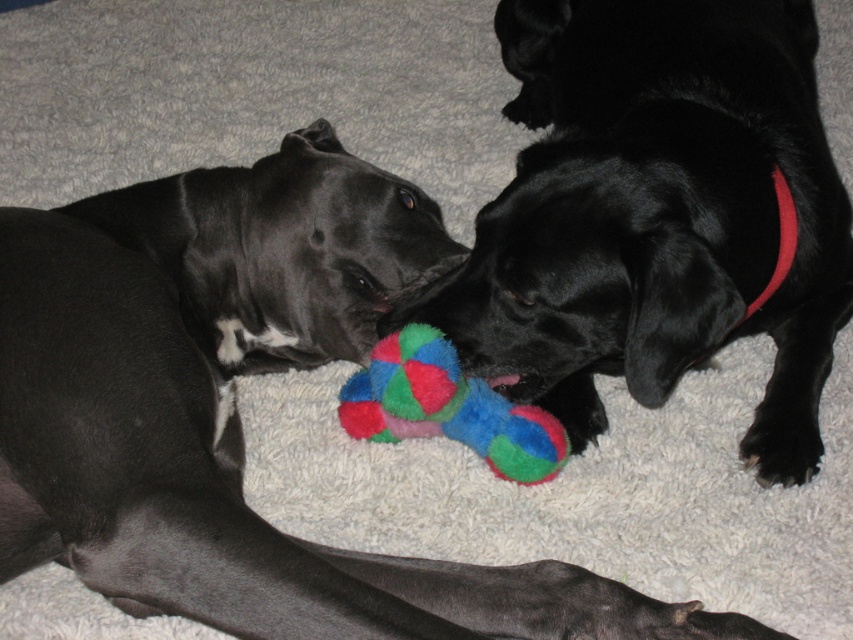
You are a dog owner trying to separate the shiny black dog at center and the multicolored plush bone at center. Can you tell me if the dog is on top of the bone or just next to it?

The shiny black dog at center is positioned over multicolored plush bone at center, so the dog is on top of the bone.

You are a dog owner who wants to buy a new toy for your shiny black dog at center. The store has a toy that is exactly the same size as the multicolored plush bone at center. Will this new toy be smaller than your dog?

The shiny black dog at center is bigger than the multicolored plush bone at center, so the new toy will be smaller than your dog.